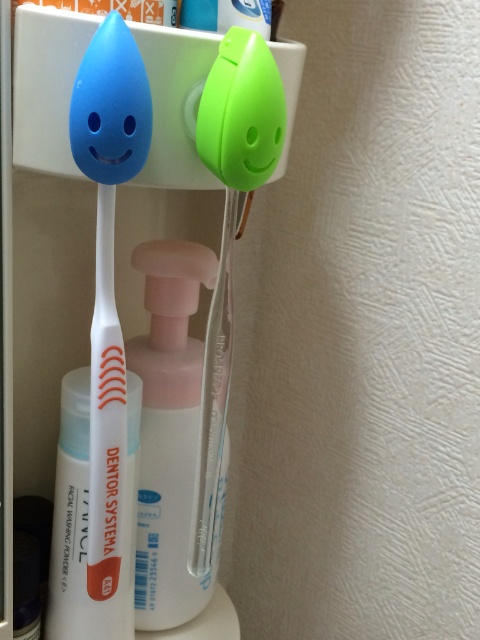
Between pink translucent pump at center and white matte tube at center, which one is positioned lower?

white matte tube at center is below.

Who is more distant from viewer, (x=152, y=593) or (x=67, y=490)?

The point (x=152, y=593) is more distant.

Who is more forward, (170,554) or (48,630)?

Point (48,630)

The image size is (480, 640). Find the location of `pink translucent pump at center`. pink translucent pump at center is located at coordinates (168, 432).

Is matte white toothbrush at left to the left of green matte toothpaste at upper center from the viewer's perspective?

Correct, you'll find matte white toothbrush at left to the left of green matte toothpaste at upper center.

Can you confirm if matte white toothbrush at left is bigger than green matte toothpaste at upper center?

Correct, matte white toothbrush at left is larger in size than green matte toothpaste at upper center.

Between point (97, 252) and point (248, 13), which one is positioned behind?

The point (248, 13) is more distant.

The image size is (480, 640). In order to click on matte white toothbrush at left in this screenshot , I will do `click(108, 300)`.

Is pink translucent pump at center positioned before green matte toothpaste at upper center?

No, it is behind green matte toothpaste at upper center.

Does pink translucent pump at center have a lesser height compared to green matte toothpaste at upper center?

In fact, pink translucent pump at center may be taller than green matte toothpaste at upper center.

Which is behind, point (200, 368) or point (254, 13)?

The point (200, 368) is behind.

Find the location of a particular element. The width and height of the screenshot is (480, 640). pink translucent pump at center is located at coordinates (168, 432).